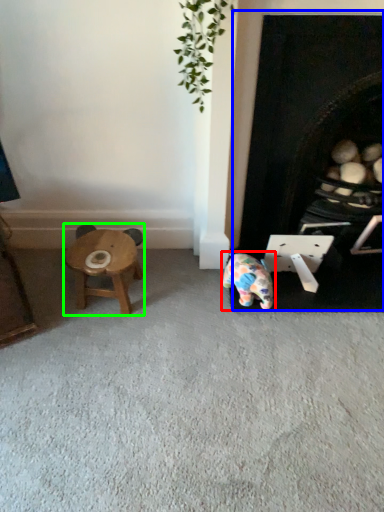
Question: Which object is positioned closest to toy (highlighted by a red box)? Select from fireplace (highlighted by a blue box) and stool (highlighted by a green box).

Choices:
 (A) fireplace
 (B) stool

Answer: (A)